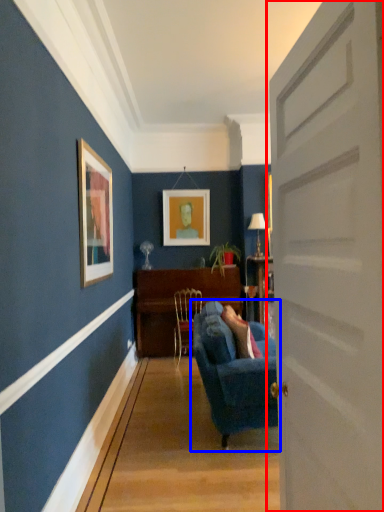
Question: Which point is further to the camera, door (highlighted by a red box) or studio couch (highlighted by a blue box)?

Choices:
 (A) door
 (B) studio couch

Answer: (B)